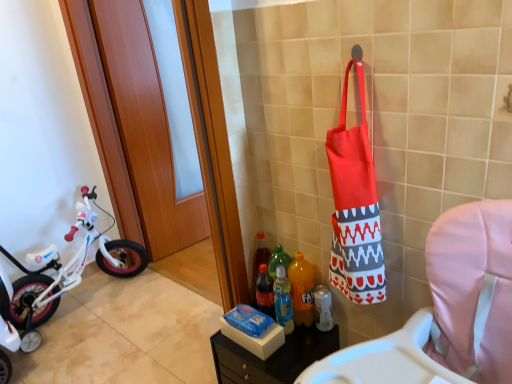
Find the location of a particular element. The height and width of the screenshot is (384, 512). vacant space underneath white matte bicycle at left (from a real-world perspective) is located at coordinates (97, 296).